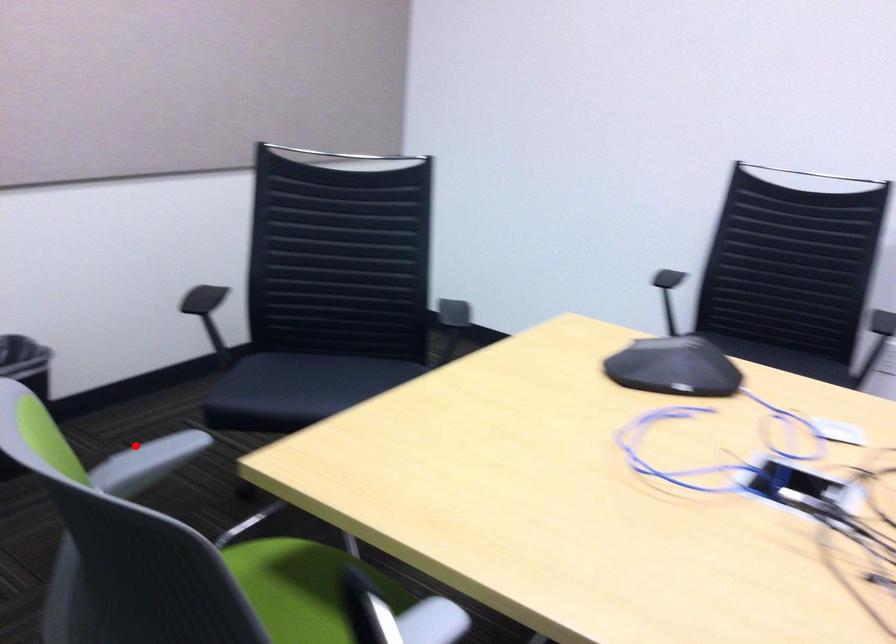
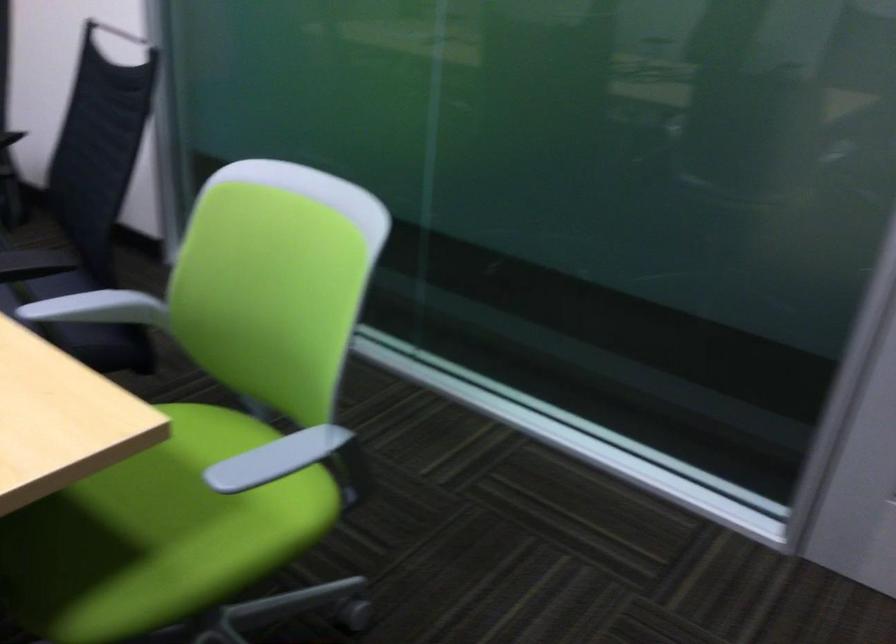
Where in the second image is the point corresponding to the highlighted location from the first image?

(276, 458)